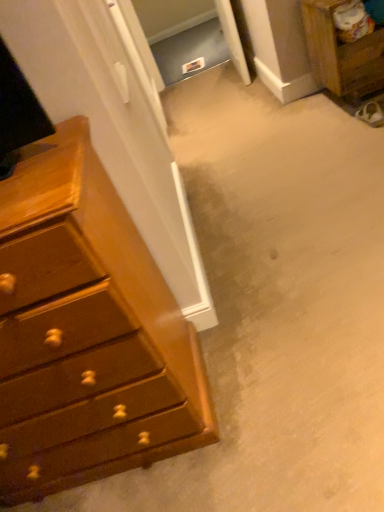
Question: Is shiny brown dresser at left outside of wooden nightstand at upper right?

Choices:
 (A) no
 (B) yes

Answer: (B)

Question: Is shiny brown dresser at left to the left of wooden nightstand at upper right from the viewer's perspective?

Choices:
 (A) yes
 (B) no

Answer: (A)

Question: Is shiny brown dresser at left aimed at wooden nightstand at upper right?

Choices:
 (A) no
 (B) yes

Answer: (A)

Question: Can you confirm if shiny brown dresser at left is positioned to the right of wooden nightstand at upper right?

Choices:
 (A) yes
 (B) no

Answer: (B)

Question: Can you confirm if shiny brown dresser at left is taller than wooden nightstand at upper right?

Choices:
 (A) yes
 (B) no

Answer: (A)

Question: Is shiny brown dresser at left behind wooden nightstand at upper right?

Choices:
 (A) no
 (B) yes

Answer: (A)

Question: Can you confirm if wooden nightstand at upper right is taller than shiny brown dresser at left?

Choices:
 (A) yes
 (B) no

Answer: (B)

Question: Can you confirm if wooden nightstand at upper right is shorter than shiny brown dresser at left?

Choices:
 (A) yes
 (B) no

Answer: (A)

Question: Is wooden nightstand at upper right to the right of shiny brown dresser at left from the viewer's perspective?

Choices:
 (A) yes
 (B) no

Answer: (A)

Question: Is wooden nightstand at upper right smaller than shiny brown dresser at left?

Choices:
 (A) no
 (B) yes

Answer: (B)

Question: Is the position of wooden nightstand at upper right less distant than that of shiny brown dresser at left?

Choices:
 (A) no
 (B) yes

Answer: (A)

Question: Could shiny brown dresser at left be considered to be inside wooden nightstand at upper right?

Choices:
 (A) yes
 (B) no

Answer: (B)

Question: Is wooden nightstand at upper right situated inside shiny brown dresser at left or outside?

Choices:
 (A) outside
 (B) inside

Answer: (A)